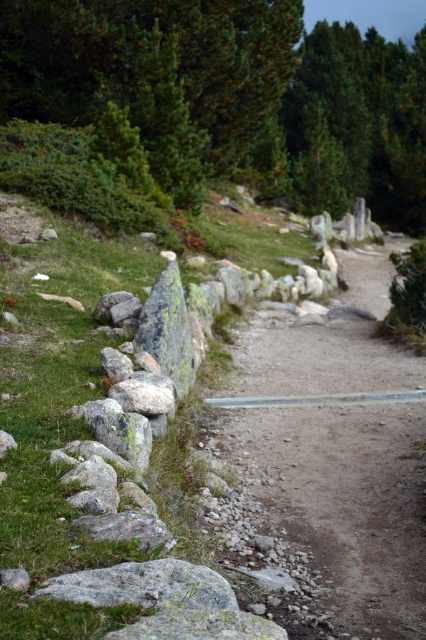
Question: Does green leafy tree at upper center lie in front of green matte tree at upper center?

Choices:
 (A) no
 (B) yes

Answer: (B)

Question: Observing the image, what is the correct spatial positioning of green matte tree at upper center in reference to gray rough rock at lower left?

Choices:
 (A) above
 (B) below

Answer: (A)

Question: Among these points, which one is farthest from the camera?

Choices:
 (A) (149, 580)
 (B) (363, 164)

Answer: (B)

Question: Among these points, which one is nearest to the camera?

Choices:
 (A) (186, 589)
 (B) (347, 168)

Answer: (A)

Question: Considering the real-world distances, which object is closest to the green leafy tree at upper center?

Choices:
 (A) green matte tree at upper center
 (B) gray rough rock at lower left

Answer: (A)

Question: Is green leafy tree at upper center thinner than green matte tree at upper center?

Choices:
 (A) no
 (B) yes

Answer: (A)